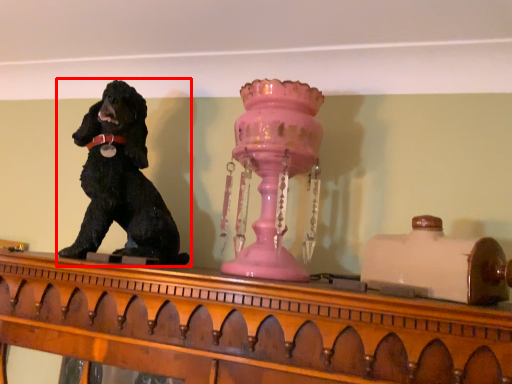
Question: From the image's perspective, what is the correct spatial relationship of dog (annotated by the red box) in relation to candle holder?

Choices:
 (A) above
 (B) below

Answer: (A)